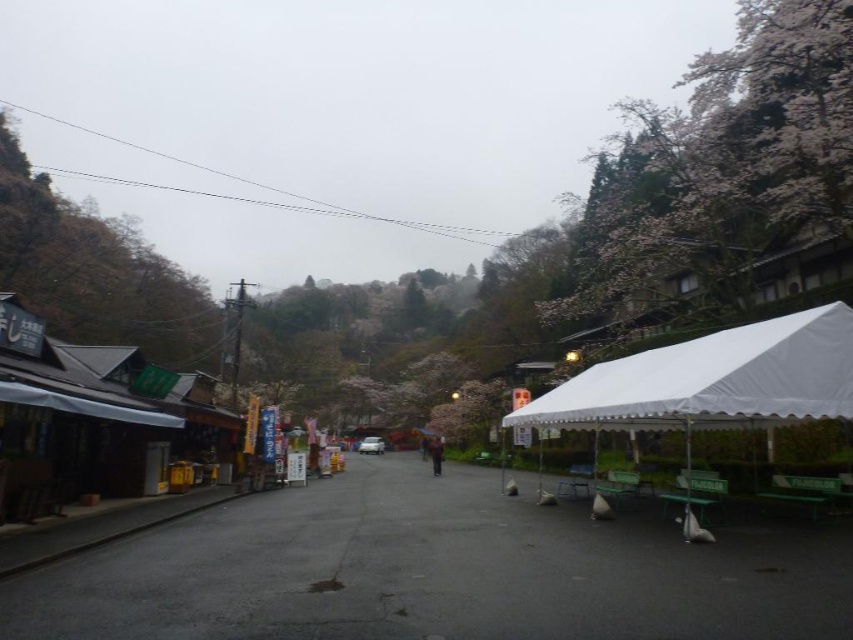
Question: Is white blossoming tree at upper right to the left of dark blue jacket at center from the viewer's perspective?

Choices:
 (A) yes
 (B) no

Answer: (B)

Question: Does white fabric tent at right have a greater width compared to brown textured tree at left?

Choices:
 (A) yes
 (B) no

Answer: (B)

Question: Among these objects, which one is farthest from the camera?

Choices:
 (A) white fabric tent at right
 (B) dark blue jacket at center
 (C) white blossoming tree at upper right
 (D) brown textured tree at left

Answer: (B)

Question: Is white blossoming tree at upper right positioned at the back of white fabric tent at right?

Choices:
 (A) no
 (B) yes

Answer: (B)

Question: Which point appears closest to the camera in this image?

Choices:
 (A) (809, 106)
 (B) (775, 422)
 (C) (430, 440)

Answer: (B)

Question: Based on their relative distances, which object is farther from the white blossoming tree at upper right?

Choices:
 (A) brown textured tree at left
 (B) white fabric tent at right

Answer: (A)